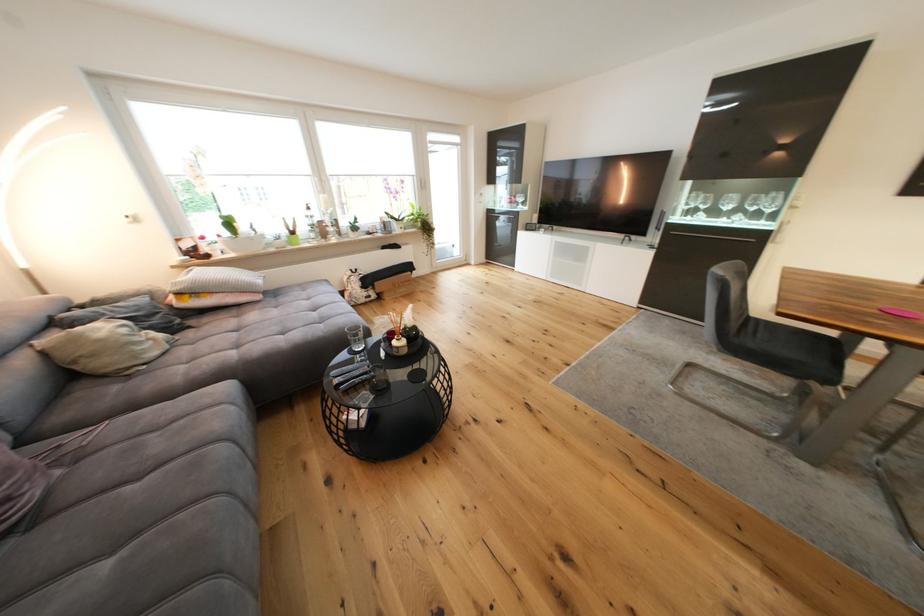
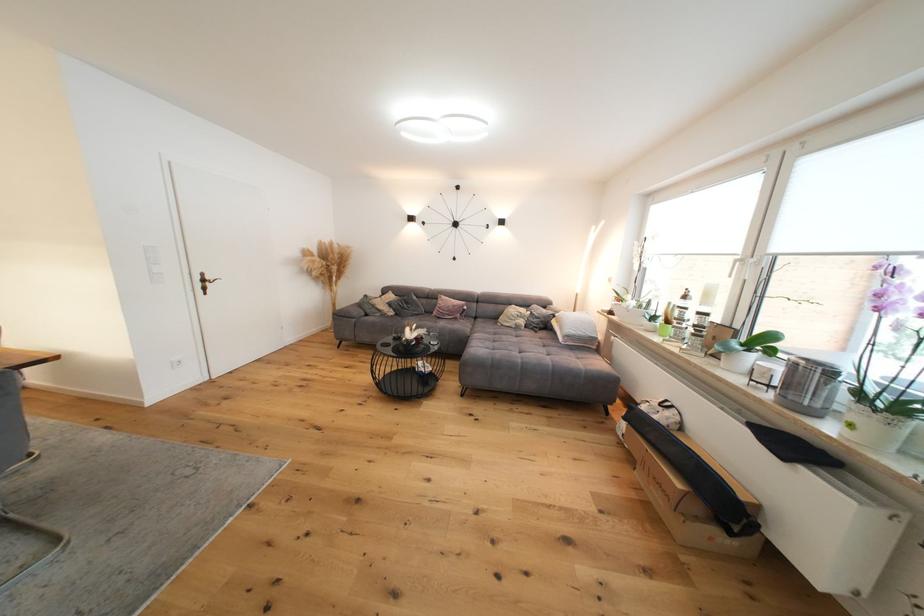
The point at (161, 336) is marked in the first image. Where is the corresponding point in the second image?

(529, 323)